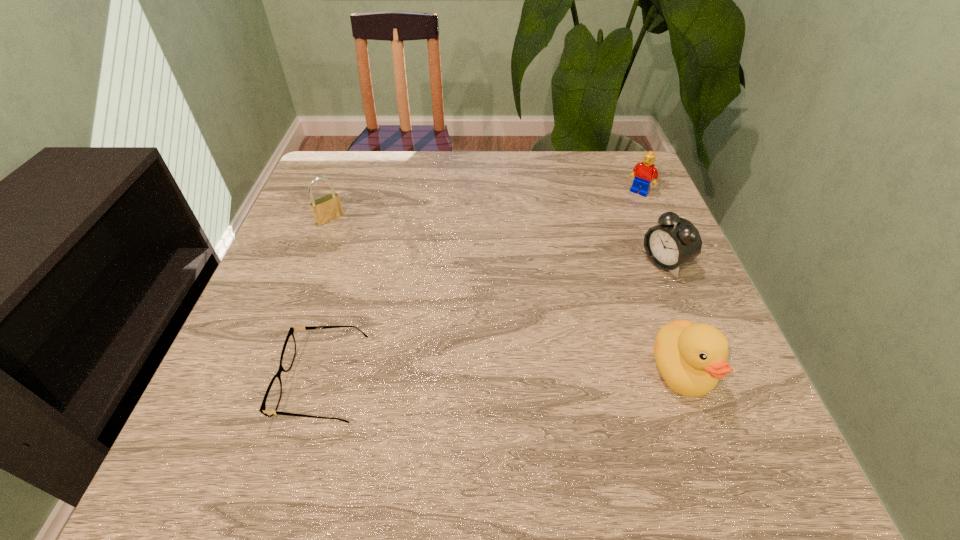
At what (x,y) coordinates should I click in order to perform the action: click on vacant space located 0.230m on the front-facing side of the farthest object. Please return your answer as a coordinate pair (x, y). Looking at the image, I should click on (596, 245).

At what (x,y) coordinates should I click in order to perform the action: click on vacant space situated 0.360m on the front-facing side of the farthest object. Please return your answer as a coordinate pair (x, y). This screenshot has width=960, height=540. Looking at the image, I should click on (570, 277).

Locate an element on the screen. blank space located on the front-facing side of the farthest object is located at coordinates (598, 242).

The height and width of the screenshot is (540, 960). Find the location of `vacant space situated on the front-facing side of the padlock`. vacant space situated on the front-facing side of the padlock is located at coordinates (406, 288).

Where is `free location located on the front-facing side of the padlock`? Image resolution: width=960 pixels, height=540 pixels. free location located on the front-facing side of the padlock is located at coordinates (406, 288).

The width and height of the screenshot is (960, 540). Identify the location of free region located 0.220m on the front-facing side of the padlock. (387, 271).

Where is `object that is at the far edge`? This screenshot has height=540, width=960. object that is at the far edge is located at coordinates (644, 172).

Find the location of a particular element. The height and width of the screenshot is (540, 960). spectacles present at the near edge is located at coordinates (271, 400).

Where is `duck that is at the near edge`? duck that is at the near edge is located at coordinates [x=691, y=358].

Where is `spectacles at the left edge`? spectacles at the left edge is located at coordinates (271, 400).